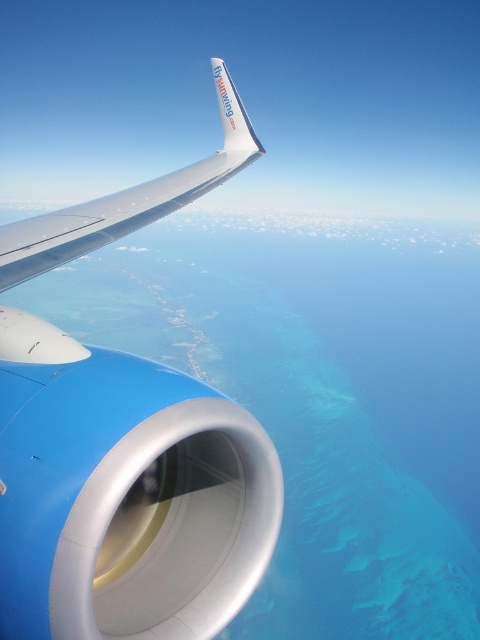
You are a passenger sitting in the airplane and looking out the window. You see the metallic silver wing at upper left and the silver metallic wing at upper left. Which one is positioned higher from the ground?

The metallic silver wing at upper left is positioned higher from the ground than the silver metallic wing at upper left because it is above it according to the description.

You are a passenger sitting in the airplane and looking out the window. You see the metallic silver wing at upper left and the silver metallic wing at upper left. Which one is to the right side of the other?

The metallic silver wing at upper left is positioned on the right side of the silver metallic wing at upper left.